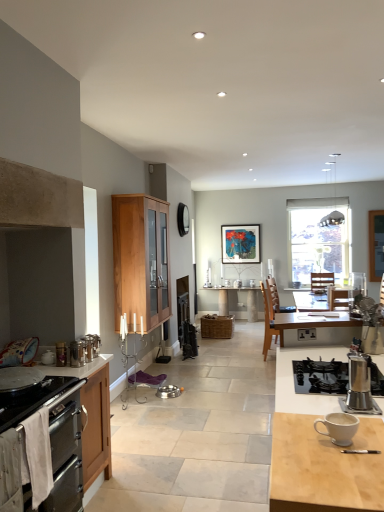
At what (x,y) coordinates should I click in order to perform the action: click on free spot to the right of metallic stainless steel pet bowls at center, which is the 1th kitchen appliance from right to left. Please return your answer as a coordinate pair (x, y). Looking at the image, I should click on (188, 394).